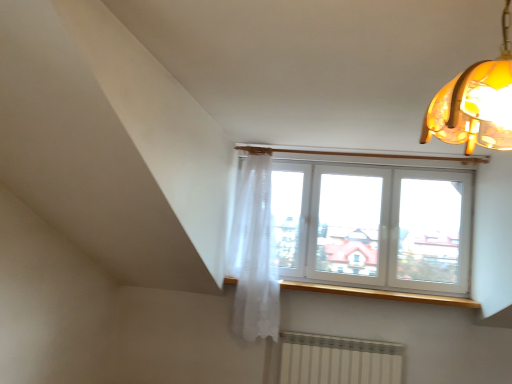
Question: Looking at the image, does wooden at upper center seem bigger or smaller compared to translucent amber glass lampshade at upper right?

Choices:
 (A) small
 (B) big

Answer: (B)

Question: Is wooden at upper center taller or shorter than translucent amber glass lampshade at upper right?

Choices:
 (A) tall
 (B) short

Answer: (B)

Question: Considering the real-world distances, which object is farthest from the translucent amber glass lampshade at upper right?

Choices:
 (A) white sheer curtain at upper center
 (B) white plastic window at upper center
 (C) wooden at upper center

Answer: (C)

Question: Estimate the real-world distances between objects in this image. Which object is farther from the white sheer curtain at upper center?

Choices:
 (A) translucent amber glass lampshade at upper right
 (B) white plastic window at upper center
 (C) wooden at upper center

Answer: (A)